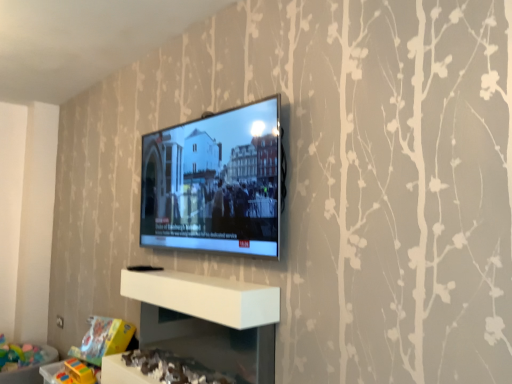
Question: Does point (146, 278) appear closer or farther from the camera than point (139, 347)?

Choices:
 (A) farther
 (B) closer

Answer: (B)

Question: Would you say white matte shelf at center, which is the second shelf from bottom to top, is to the left or to the right of white glossy shelf at lower center, placed as the 1th shelf when sorted from bottom to top, in the picture?

Choices:
 (A) right
 (B) left

Answer: (A)

Question: Which object is positioned closest to the white matte shelf at center, which is the second shelf from bottom to top?

Choices:
 (A) matte black tv at center
 (B) white glossy shelf at lower center, the second shelf positioned from the top

Answer: (B)

Question: Considering the real-world distances, which object is farthest from the white glossy shelf at lower center, the second shelf positioned from the top?

Choices:
 (A) white matte shelf at center, the 1th shelf from the top
 (B) matte black tv at center

Answer: (B)